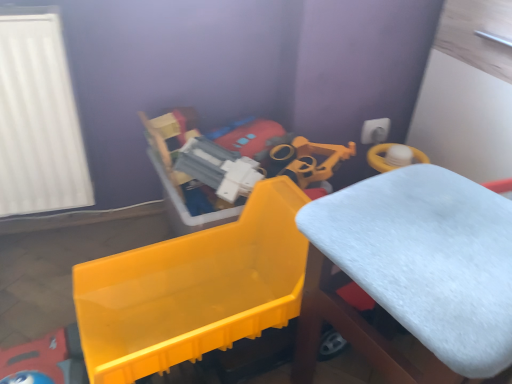
Question: Considering the relative positions of white fluffy cushion at center and shiny plastic toy at left in the image provided, is white fluffy cushion at center in front of shiny plastic toy at left?

Choices:
 (A) yes
 (B) no

Answer: (A)

Question: Considering the relative positions of white fluffy cushion at center and shiny plastic toy at left in the image provided, is white fluffy cushion at center to the left of shiny plastic toy at left from the viewer's perspective?

Choices:
 (A) yes
 (B) no

Answer: (B)

Question: Are white fluffy cushion at center and shiny plastic toy at left beside each other?

Choices:
 (A) yes
 (B) no

Answer: (B)

Question: Would you say white fluffy cushion at center is a long distance from shiny plastic toy at left?

Choices:
 (A) yes
 (B) no

Answer: (B)

Question: Is white fluffy cushion at center oriented away from shiny plastic toy at left?

Choices:
 (A) no
 (B) yes

Answer: (B)

Question: Considering the relative sizes of white fluffy cushion at center and shiny plastic toy at left in the image provided, is white fluffy cushion at center bigger than shiny plastic toy at left?

Choices:
 (A) no
 (B) yes

Answer: (B)

Question: Is shiny plastic toy at left not inside white fluffy cushion at center?

Choices:
 (A) no
 (B) yes

Answer: (B)

Question: From the image's perspective, is shiny plastic toy at left below white fluffy cushion at center?

Choices:
 (A) yes
 (B) no

Answer: (B)

Question: Considering the relative sizes of shiny plastic toy at left and white fluffy cushion at center in the image provided, is shiny plastic toy at left taller than white fluffy cushion at center?

Choices:
 (A) no
 (B) yes

Answer: (A)

Question: Can you confirm if shiny plastic toy at left is positioned to the left of white fluffy cushion at center?

Choices:
 (A) yes
 (B) no

Answer: (A)

Question: Can you confirm if shiny plastic toy at left is thinner than white fluffy cushion at center?

Choices:
 (A) yes
 (B) no

Answer: (A)

Question: From a real-world perspective, is shiny plastic toy at left positioned under white fluffy cushion at center based on gravity?

Choices:
 (A) yes
 (B) no

Answer: (A)

Question: From the image's perspective, relative to shiny plastic toy at left, is white fluffy cushion at center above or below?

Choices:
 (A) above
 (B) below

Answer: (B)